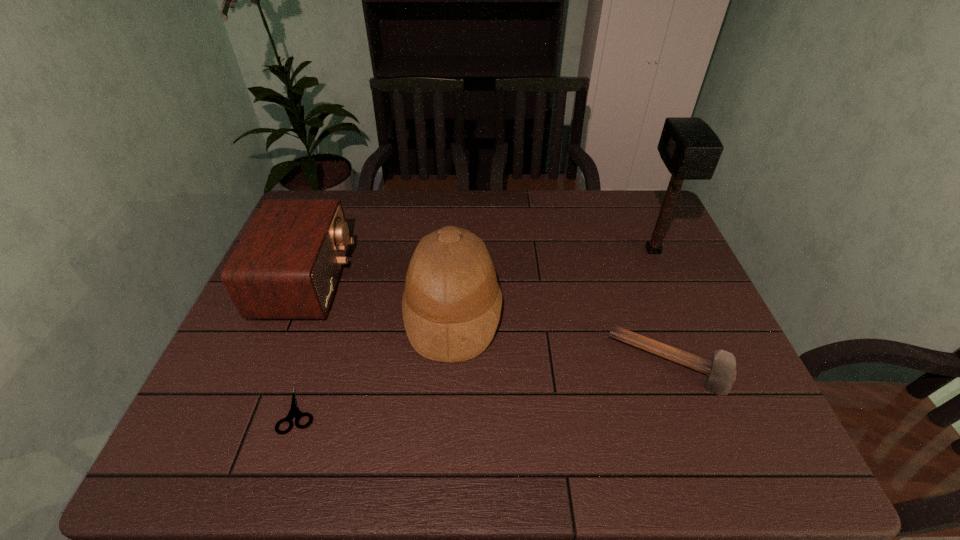
The height and width of the screenshot is (540, 960). In order to click on vacant point located between the third object from left to right and the farther mallet in this screenshot , I will do `click(553, 281)`.

Identify the location of vacant area that lies between the third object from left to right and the third tallest object. click(380, 297).

Where is `unoccupied position between the fourth tallest object and the tallest object`? Image resolution: width=960 pixels, height=540 pixels. unoccupied position between the fourth tallest object and the tallest object is located at coordinates (661, 307).

Find the location of a particular element. free space between the third object from left to right and the radio receiver is located at coordinates (380, 297).

You are a GUI agent. You are given a task and a screenshot of the screen. Output one action in this format:
    pyautogui.click(x=<x>, y=<y>)
    Task: Click on the blank region between the farther mallet and the fourth tallest object
    
    Given the screenshot: What is the action you would take?
    pyautogui.click(x=661, y=307)

Locate an element on the screen. vacant region between the shorter mallet and the fourth shortest object is located at coordinates (562, 338).

Find the location of a particular element. The image size is (960, 540). vacant area that lies between the hat and the third tallest object is located at coordinates (380, 297).

Identify which object is the nearest to the nearer mallet. Please provide its 2D coordinates. Your answer should be formatted as a tuple, i.e. [(x, y)], where the tuple contains the x and y coordinates of a point satisfying the conditions above.

[(690, 149)]

Locate an element on the screen. Image resolution: width=960 pixels, height=540 pixels. the third closest object to the third shortest object is located at coordinates (720, 371).

Locate an element on the screen. The image size is (960, 540). vacant space that satisfies the following two spatial constraints: 1. on the front panel of the radio receiver; 2. on the left side of the nearer mallet is located at coordinates (274, 363).